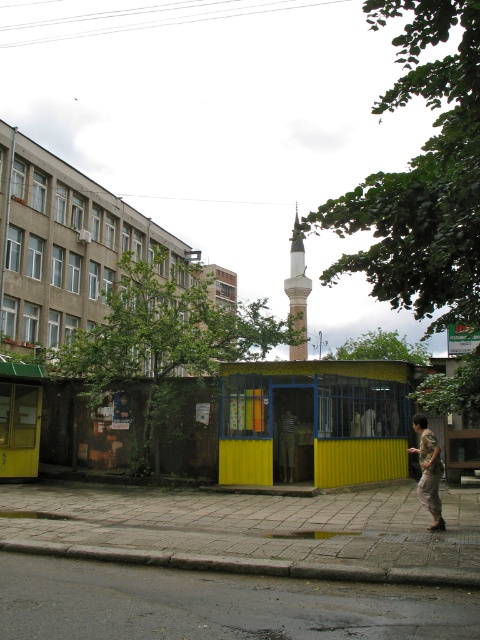
Question: Considering the real-world distances, which object is closest to the concrete paving stones at lower center?

Choices:
 (A) dark gray asphalt at lower center
 (B) white marble minaret at center
 (C) camouflage-patterned pants at lower right

Answer: (A)

Question: Estimate the real-world distances between objects in this image. Which object is farther from the white marble minaret at center?

Choices:
 (A) concrete paving stones at lower center
 (B) dark gray asphalt at lower center
 (C) camouflage-patterned pants at lower right

Answer: (C)

Question: In this image, where is concrete paving stones at lower center located relative to camouflage-patterned pants at lower right?

Choices:
 (A) below
 (B) above

Answer: (A)

Question: Among these objects, which one is farthest from the camera?

Choices:
 (A) white marble minaret at center
 (B) dark gray asphalt at lower center
 (C) concrete paving stones at lower center

Answer: (A)

Question: Is the position of concrete paving stones at lower center more distant than that of white marble minaret at center?

Choices:
 (A) yes
 (B) no

Answer: (B)

Question: In this image, where is concrete paving stones at lower center located relative to white marble minaret at center?

Choices:
 (A) right
 (B) left

Answer: (B)